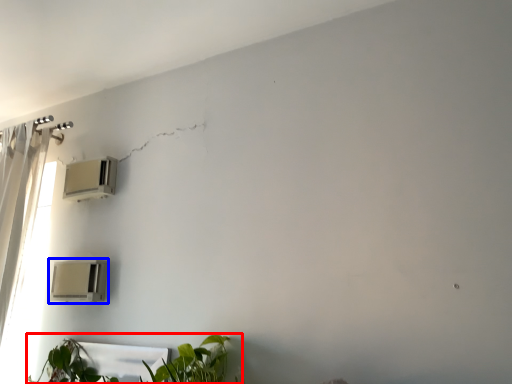
Question: Among these objects, which one is farthest to the camera, houseplant (highlighted by a red box) or air conditioning (highlighted by a blue box)?

Choices:
 (A) houseplant
 (B) air conditioning

Answer: (B)